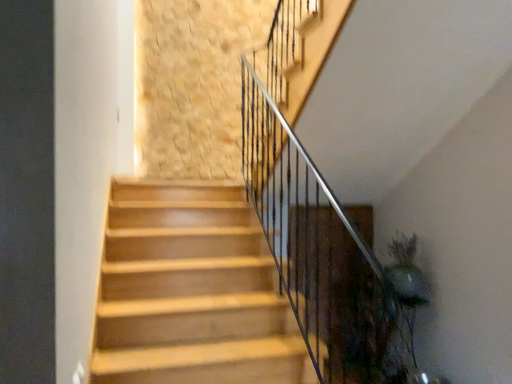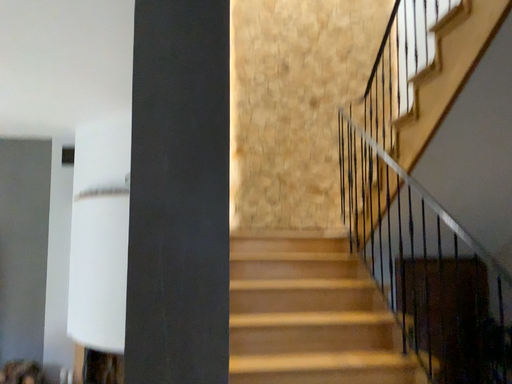
Question: Which way did the camera rotate in the video?

Choices:
 (A) rotated upward
 (B) rotated downward

Answer: (A)